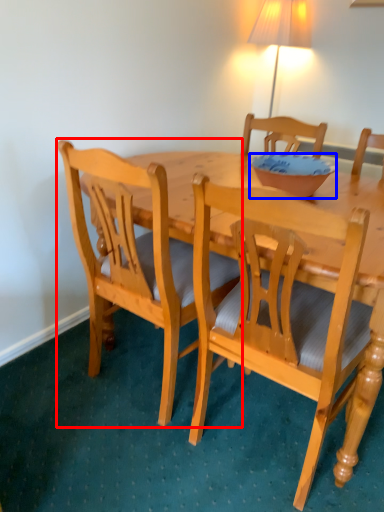
Question: Which object appears farthest to the camera in this image, chair (highlighted by a red box) or bowl (highlighted by a blue box)?

Choices:
 (A) chair
 (B) bowl

Answer: (B)